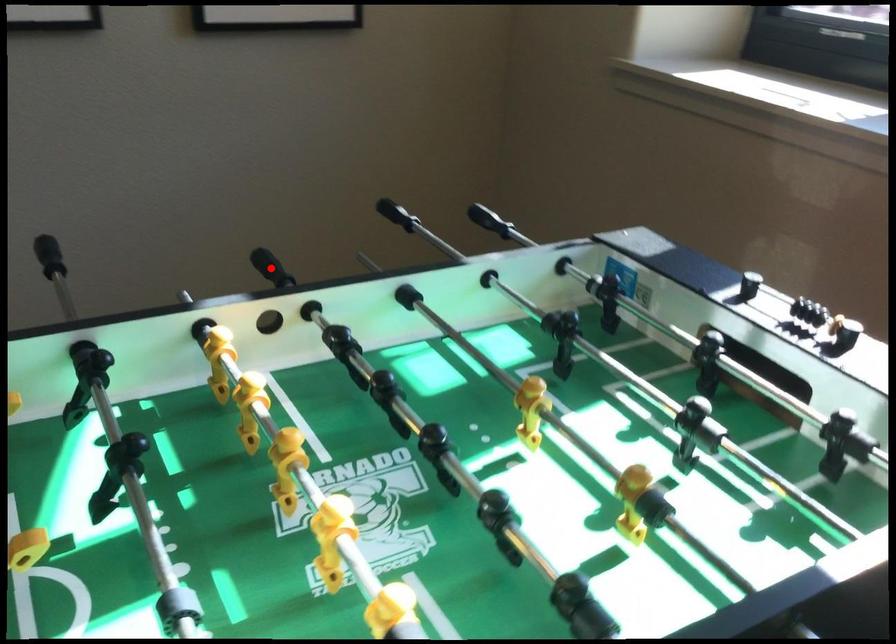
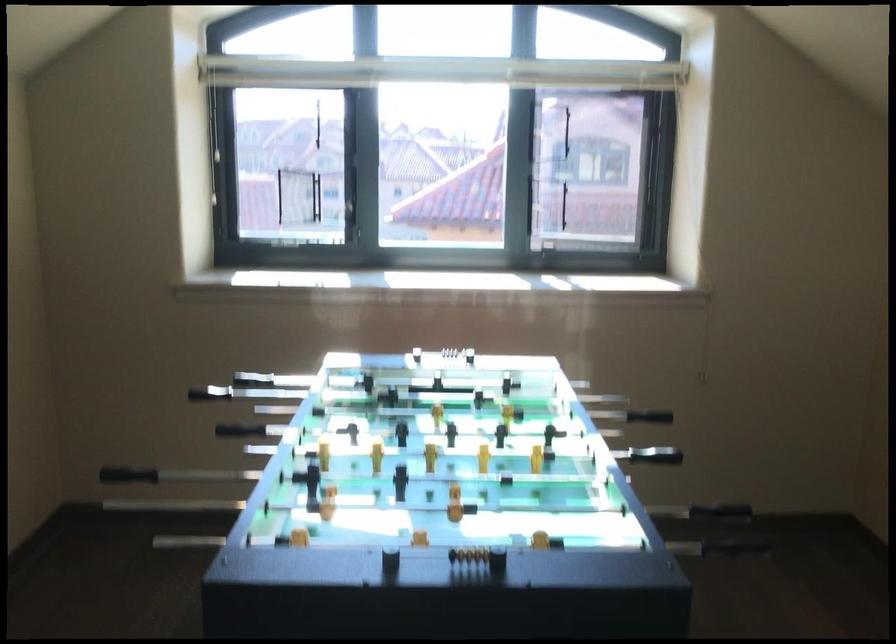
Question: I am providing you with two images of the same scene from different viewpoints. A red point is shown in image1. For the corresponding object point in image2, is it positioned nearer or farther from the camera?

Choices:
 (A) Nearer
 (B) Farther

Answer: (B)